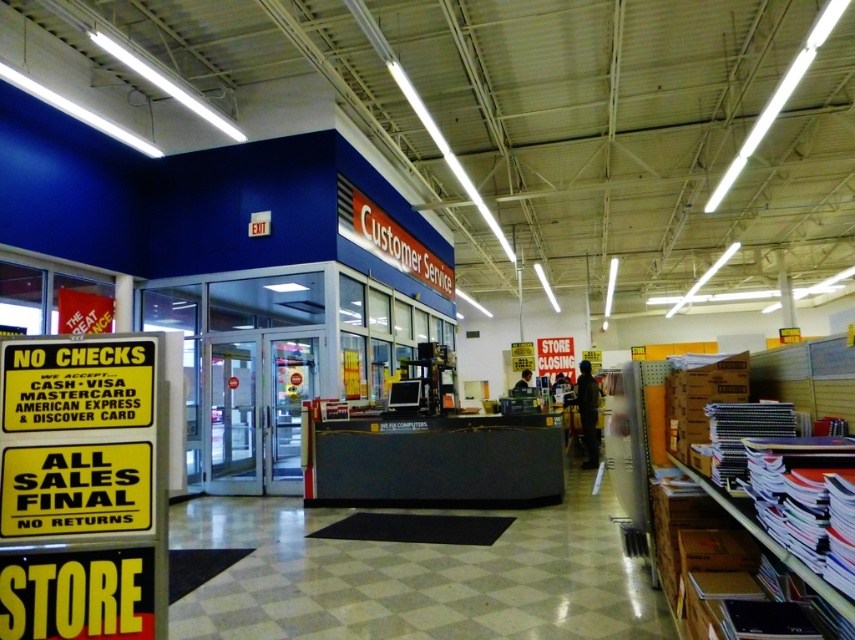
You are a customer who just finished shopping and need to pay. You see the stacked paper at right and the dark clothing figure at center. Which object is closer to the exit? Please explain your reasoning based on their positions.

The stacked paper at right is to the left of dark clothing figure at center, so the dark clothing figure at center is closer to the exit since it is positioned further to the right than the stacked paper.

You are a customer who just finished shopping and are standing in the retail store. You see the stacked paper at right and the dark clothing figure at center. Which object is higher up in the image?

The stacked paper at right is located above the dark clothing figure at center, so it is higher up in the image.